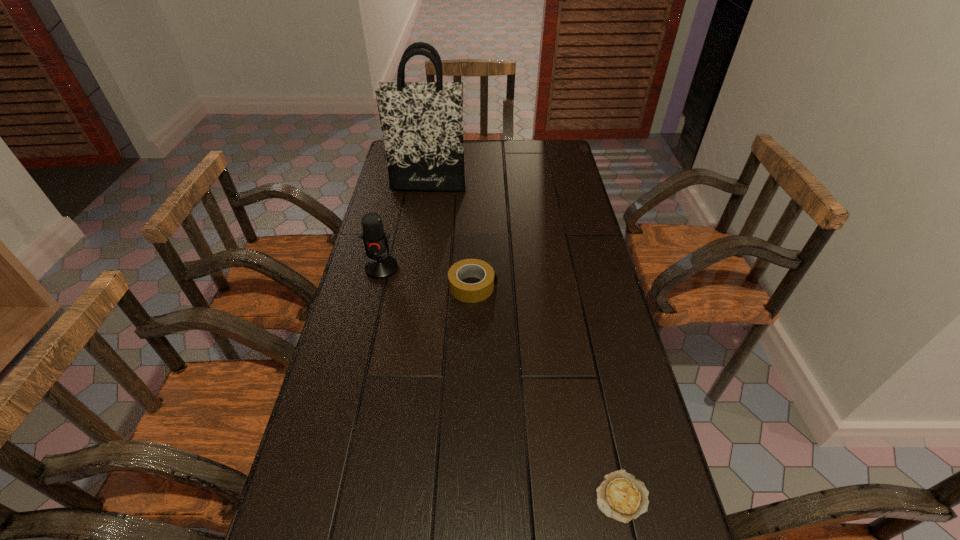
Find the location of a particular element. shopping bag that is at the left edge is located at coordinates (422, 122).

Locate an element on the screen. The width and height of the screenshot is (960, 540). microphone at the left edge is located at coordinates (379, 266).

What are the coordinates of `object present at the right edge` in the screenshot? It's located at (621, 496).

Image resolution: width=960 pixels, height=540 pixels. Identify the location of vacant space at the left edge. (410, 205).

Locate an element on the screen. Image resolution: width=960 pixels, height=540 pixels. blank area at the right edge is located at coordinates [x=596, y=350].

At what (x,y) coordinates should I click in order to perform the action: click on free area in between the farthest object and the second shortest object. Please return your answer as a coordinate pair (x, y). Looking at the image, I should click on (450, 235).

Where is `free area in between the rightmost object and the farthest object`? The height and width of the screenshot is (540, 960). free area in between the rightmost object and the farthest object is located at coordinates (525, 340).

The height and width of the screenshot is (540, 960). In order to click on unoccupied area between the second tallest object and the quiche in this screenshot , I will do `click(502, 382)`.

Identify the location of vacant space that's between the tallest object and the shortest object. This screenshot has width=960, height=540. (525, 340).

Find the location of a particular element. The image size is (960, 540). vacant area that lies between the quiche and the third shortest object is located at coordinates (502, 382).